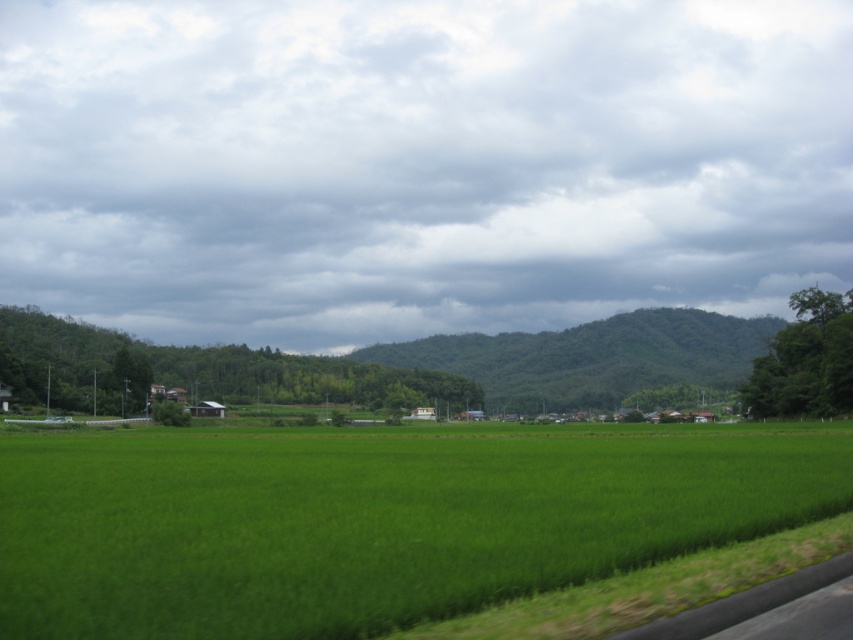
Where is `cloudy sky at upper center`? This screenshot has width=853, height=640. cloudy sky at upper center is located at coordinates (418, 163).

Does cloudy sky at upper center have a larger size compared to green leafy mountain at center?

Indeed, cloudy sky at upper center has a larger size compared to green leafy mountain at center.

Does point (410, 44) come closer to viewer compared to point (759, 342)?

No, it is not.

Identify the location of cloudy sky at upper center. The height and width of the screenshot is (640, 853). (418, 163).

Looking at this image, is green grass at center thinner than green leafy mountain at center?

Correct, green grass at center's width is less than green leafy mountain at center's.

Between green grass at center and green leafy mountain at center, which one is positioned lower?

green grass at center is lower down.

Image resolution: width=853 pixels, height=640 pixels. Find the location of `green grass at center`. green grass at center is located at coordinates (374, 518).

Is cloudy sky at upper center to the right of green grass at center from the viewer's perspective?

Incorrect, cloudy sky at upper center is not on the right side of green grass at center.

Is point (584, 51) positioned behind point (340, 433)?

Yes.

Is point (546, 269) closer to viewer compared to point (331, 616)?

No.

At what (x,y) coordinates should I click in order to perform the action: click on cloudy sky at upper center. Please return your answer as a coordinate pair (x, y). This screenshot has width=853, height=640. Looking at the image, I should click on (418, 163).